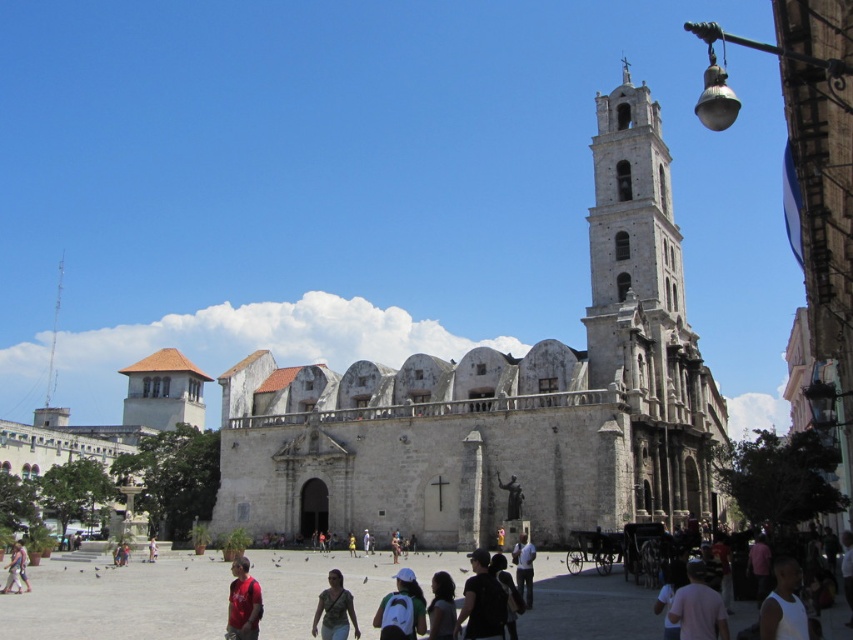
Question: Does white stone tower at center appear on the right side of white tank top at center?

Choices:
 (A) yes
 (B) no

Answer: (A)

Question: Which of the following is the farthest from the observer?

Choices:
 (A) (248, 426)
 (B) (393, 627)
 (C) (471, 577)

Answer: (A)

Question: Can you confirm if white tank top at center is positioned above dark brown hair at center?

Choices:
 (A) no
 (B) yes

Answer: (B)

Question: Estimate the real-world distances between objects in this image. Which object is farther from the white tank top at center?

Choices:
 (A) white matte backpack at center
 (B) pink fabric dress at center

Answer: (B)

Question: Is pink fabric shirt at lower right closer to camera compared to matte gray shirt at center?

Choices:
 (A) yes
 (B) no

Answer: (A)

Question: Which object appears closest to the camera in this image?

Choices:
 (A) light brown leather jacket at lower center
 (B) white tank top at center

Answer: (B)